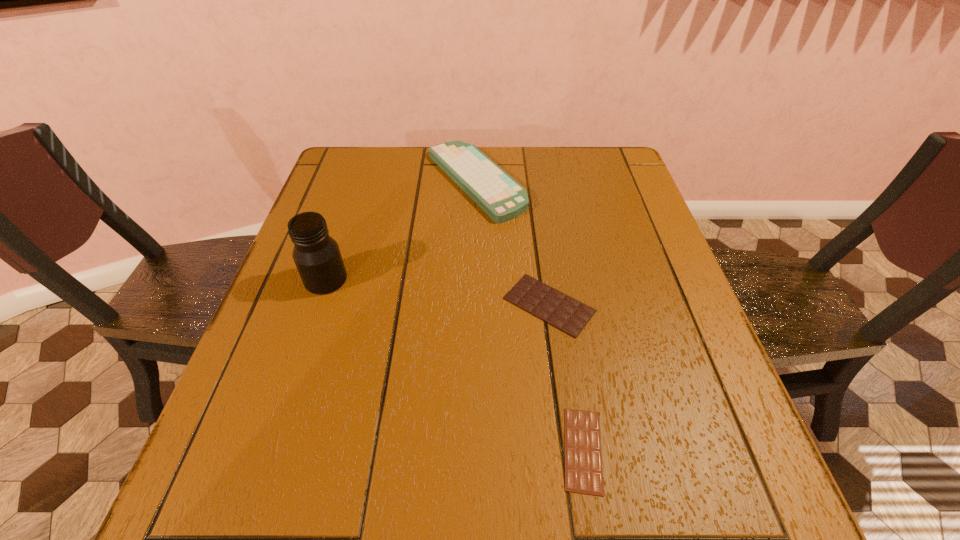
The height and width of the screenshot is (540, 960). I want to click on free region located on the left of the second shortest object, so click(x=442, y=305).

Where is `vacant space located on the right of the nearest object`? This screenshot has width=960, height=540. vacant space located on the right of the nearest object is located at coordinates (716, 450).

I want to click on object that is at the far edge, so click(x=502, y=198).

This screenshot has width=960, height=540. Identify the location of object that is at the near edge. (583, 460).

In order to click on object situated at the left edge in this screenshot , I will do `click(317, 256)`.

Where is `free spot at the far edge of the desktop`? This screenshot has height=540, width=960. free spot at the far edge of the desktop is located at coordinates (539, 185).

Find the location of `vacant space at the left edge of the desktop`. vacant space at the left edge of the desktop is located at coordinates (281, 322).

Where is `vacant area at the right edge`? Image resolution: width=960 pixels, height=540 pixels. vacant area at the right edge is located at coordinates (718, 436).

I want to click on free spot at the far left corner of the desktop, so click(x=370, y=172).

Where is `vacant space at the near left corner of the desktop`? This screenshot has width=960, height=540. vacant space at the near left corner of the desktop is located at coordinates (276, 514).